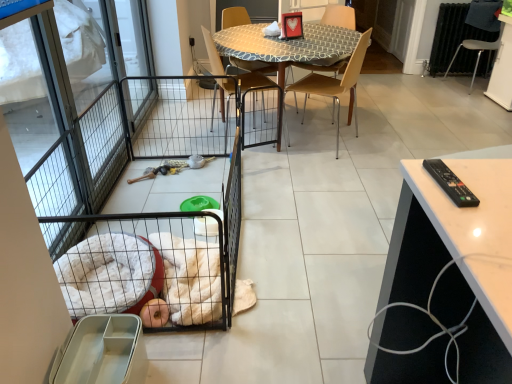
Find the location of a particular element. The height and width of the screenshot is (384, 512). vacant area to the right of light brown plastic chair at center, the 3th chair when ordered from right to left is located at coordinates (373, 136).